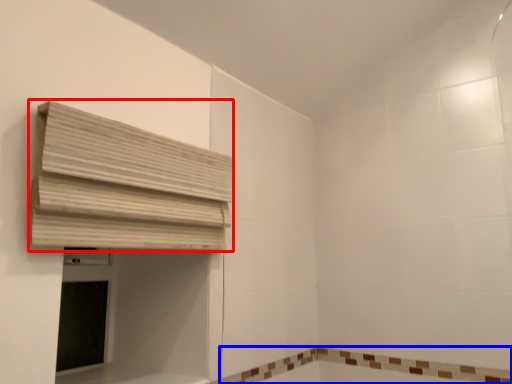
Question: Which object is further to the camera taking this photo, curtain (highlighted by a red box) or bath (highlighted by a blue box)?

Choices:
 (A) curtain
 (B) bath

Answer: (B)